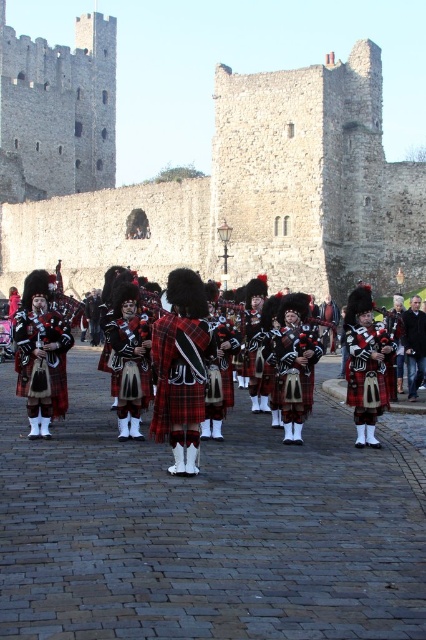
You are a painter standing in the courtyard, wanting to paint both the stone wall at center and the red plaid kilt at left. Which object should you focus on first if you want to paint the wider one?

The stone wall at center might be wider than red plaid kilt at left, so you should focus on painting the stone wall at center first.

Based on the photo, you are standing in the courtyard in front of the castle and see two points marked in the scene. The first point is at coordinates point (40, 323) and the second is at point (403, 344). Which of these points is closer to you?

Point (40, 323) is in front of point (403, 344), so it is closer to you.

You are a photographer planning to capture the pipers in front of the castle. You need to ensure that both the red plaid kilt at left and the dark blue leather jacket at center are clearly visible in the frame. Based on their positions, which item is positioned higher in the image?

The red plaid kilt at left is taller than the dark blue leather jacket at center, so the red plaid kilt at left is positioned higher in the image.